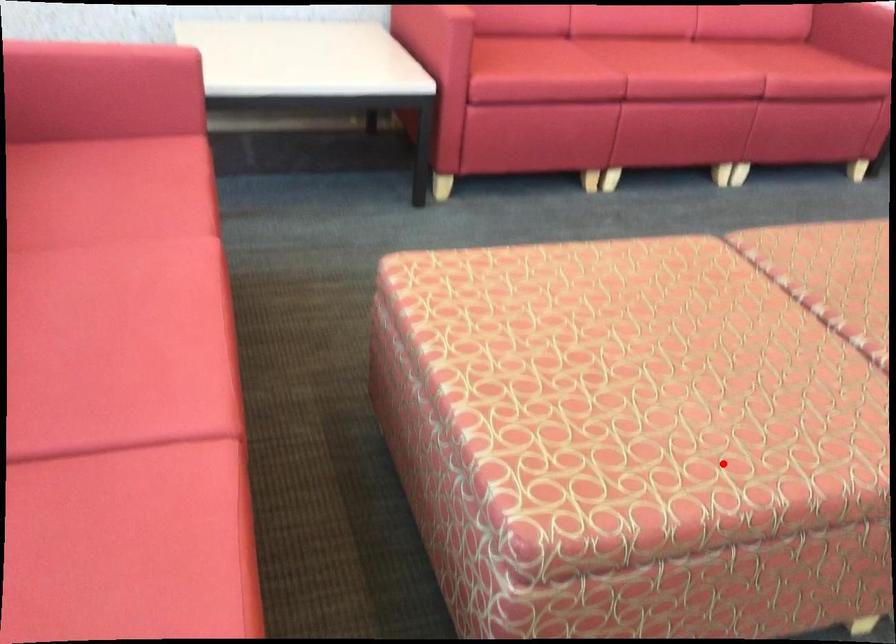
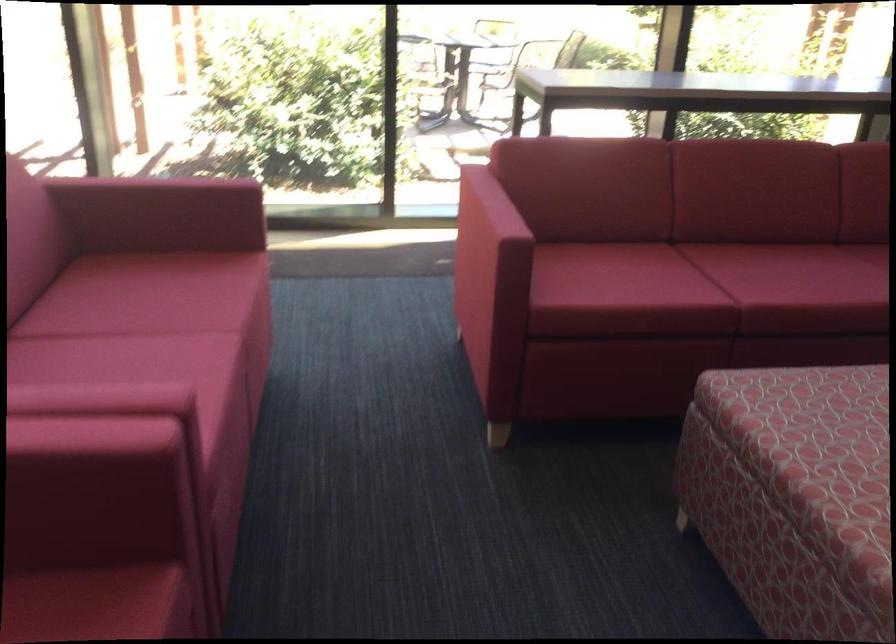
Locate, in the second image, the point that corresponds to the highlighted location in the first image.

(815, 460)